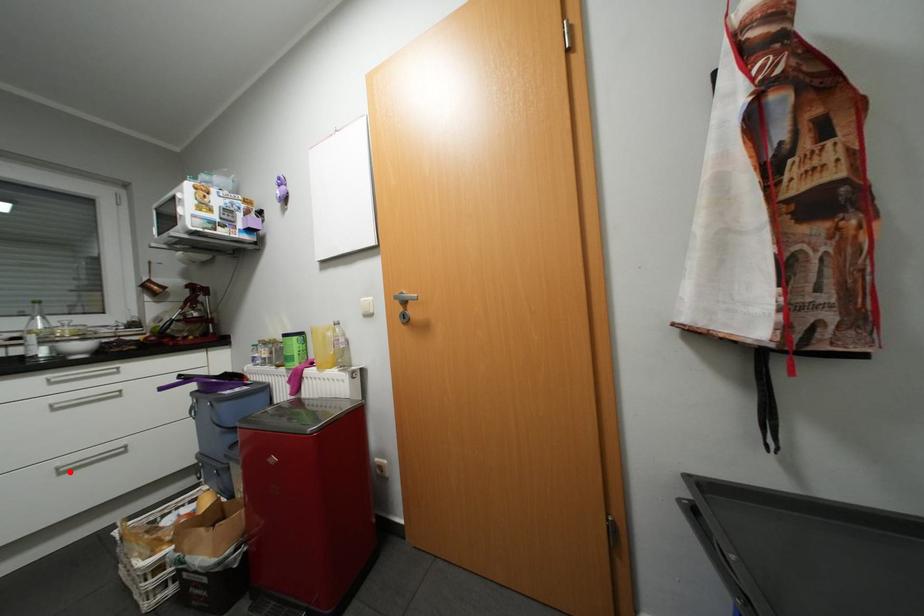
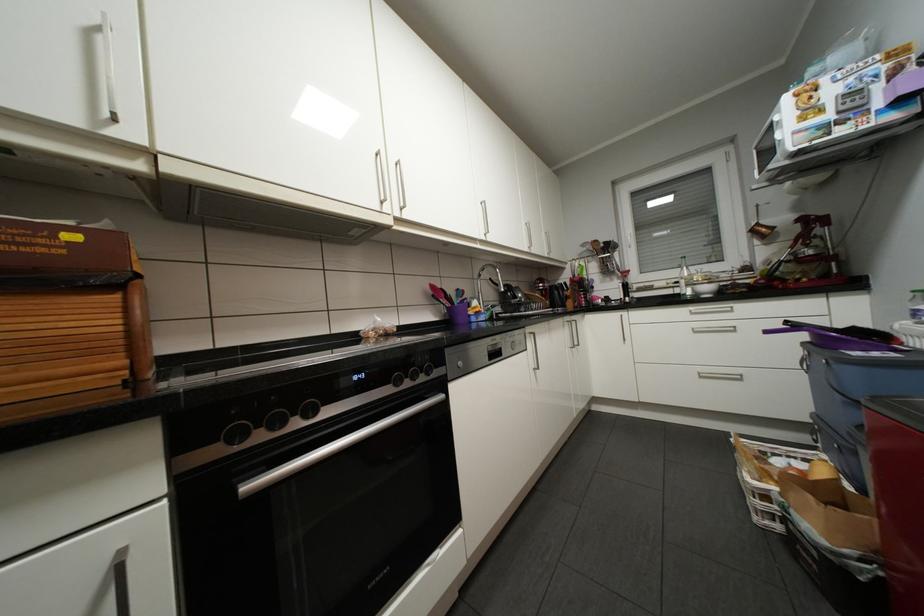
Locate, in the second image, the point that corresponds to the highlighted location in the first image.

(709, 377)